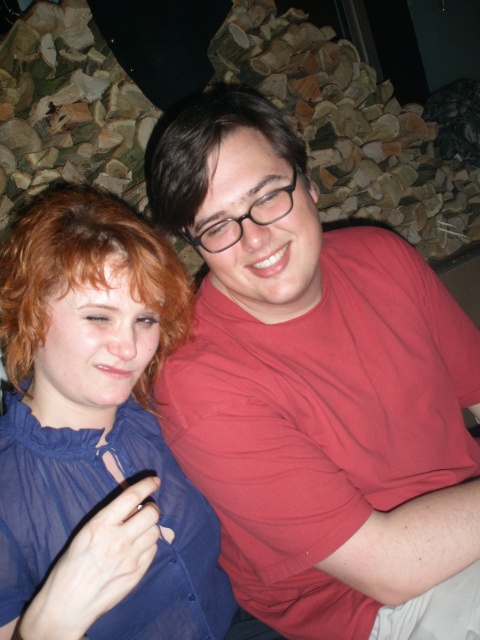
You are a photographer setting up a shoot in this scene. You need to place a small prop between the matte red shirt at center and the reddish brown curly hair at left. Based on their positions, where should the prop be placed relative to the two objects?

The matte red shirt at center is located below the reddish brown curly hair at left, so the prop should be placed between them vertically, below the reddish brown curly hair at left and above the matte red shirt at center.

You are a photographer setting up a shoot in this scene. You need to position a light source to the left of both the matte red shirt at center and the blue satin blouse at upper left. Is this possible given their positions?

The matte red shirt at center is to the right of the blue satin blouse at upper left, so placing a light source to the left of both would require positioning it to the left of the blue satin blouse at upper left since it is already the leftmost object between the two.

You are a photographer adjusting the lighting in the scene. You need to ensure that both the blue satin blouse at upper left and the reddish brown curly hair at left are well lit. Since the lighting is currently dim, where should you place the light source to illuminate both objects effectively?

The blue satin blouse at upper left is below the reddish brown curly hair at left. To illuminate both effectively, place the light source above the reddish brown curly hair at left so that it can shine down onto both the hair and the blouse below.